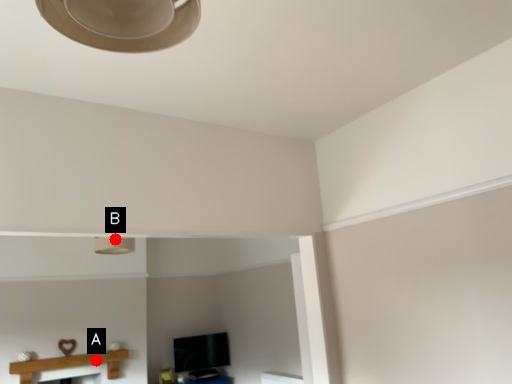
Question: Two points are circled on the image, labeled by A and B beside each circle. Which point is closer to the camera?

Choices:
 (A) A is closer
 (B) B is closer

Answer: (B)